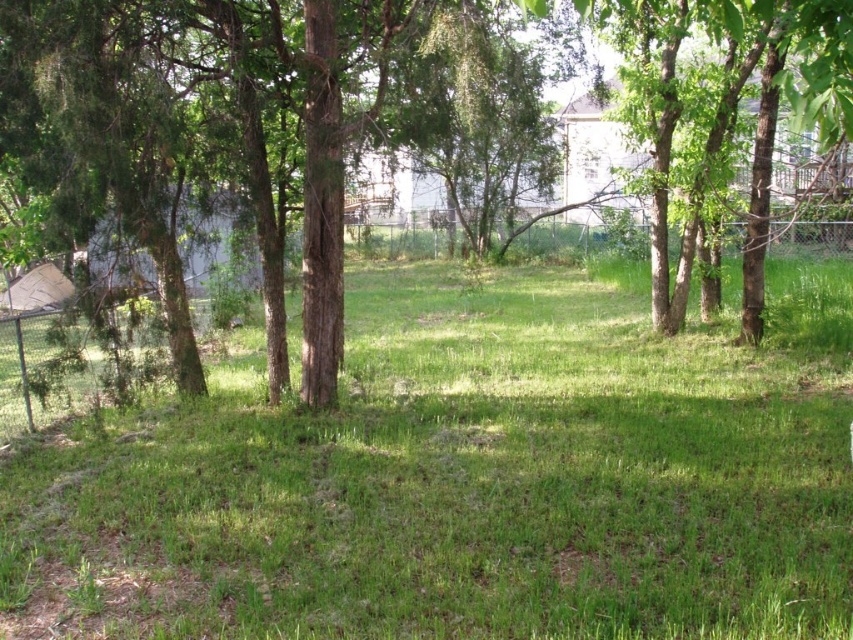
Is green grassy at center positioned at the back of green leafy tree at center?

No, it is in front of green leafy tree at center.

Where is `green grassy at center`? The width and height of the screenshot is (853, 640). green grassy at center is located at coordinates (465, 480).